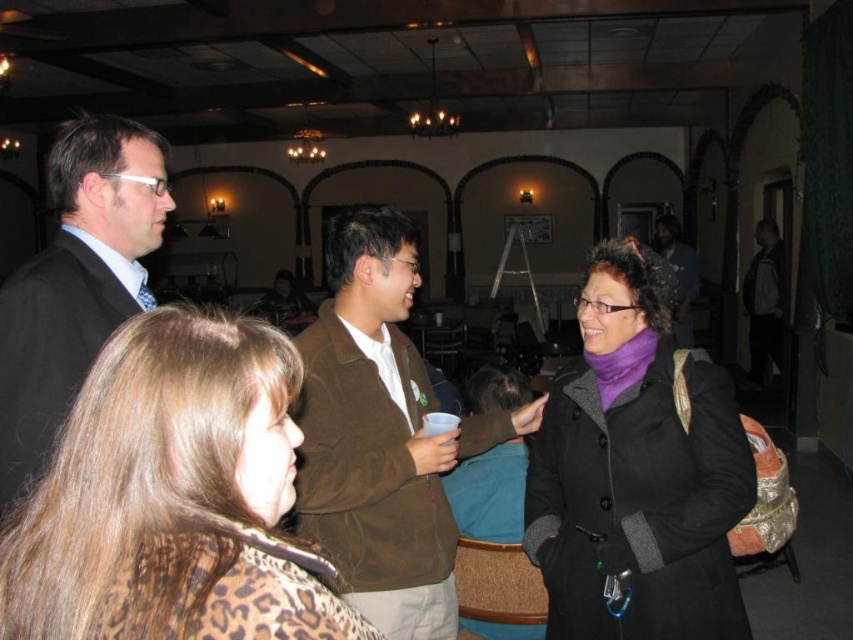
You are a photographer standing at the point marked as point (550,582). You want to take a photo of the group of four people in the foreground. Can you fit all four people into your camera frame if your camera has a maximum viewing angle of 60 degrees?

The four people are 1.88 meters apart, so with a 60 degree viewing angle, the photographer can fit all four people into the frame.

You are at a social event and see two jackets hanging on a rack in the center of the room. The brown suede jacket at center and the dark brown leather jacket at center. Which one is positioned to the left?

The brown suede jacket at center is positioned to the left of the dark brown leather jacket at center.

You are standing in the banquet hall and need to locate the brown suede jacket at center. According to the coordinates provided, where should you look to find it?

The brown suede jacket at center is located at the 2D coordinates point (381, 435).